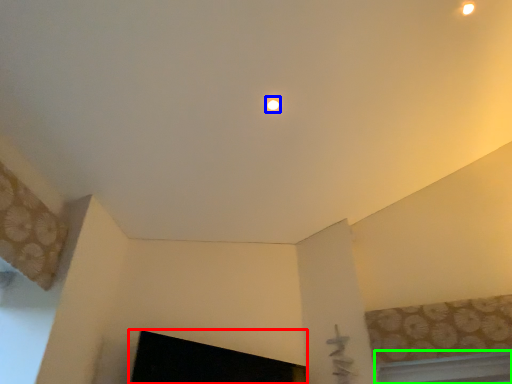
Question: Estimate the real-world distances between objects in this image. Which object is farther from fireplace (highlighted by a red box), lighting (highlighted by a blue box) or window (highlighted by a green box)?

Choices:
 (A) lighting
 (B) window

Answer: (A)